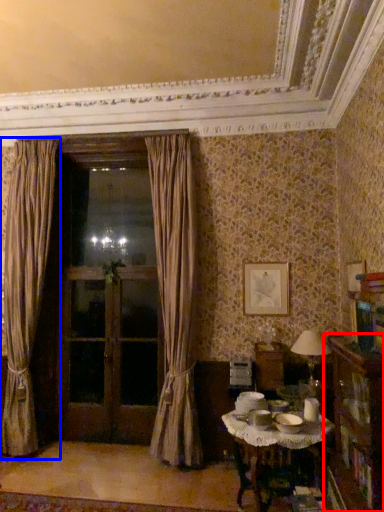
Question: Among these objects, which one is nearest to the camera, bookcase (highlighted by a red box) or curtain (highlighted by a blue box)?

Choices:
 (A) bookcase
 (B) curtain

Answer: (A)